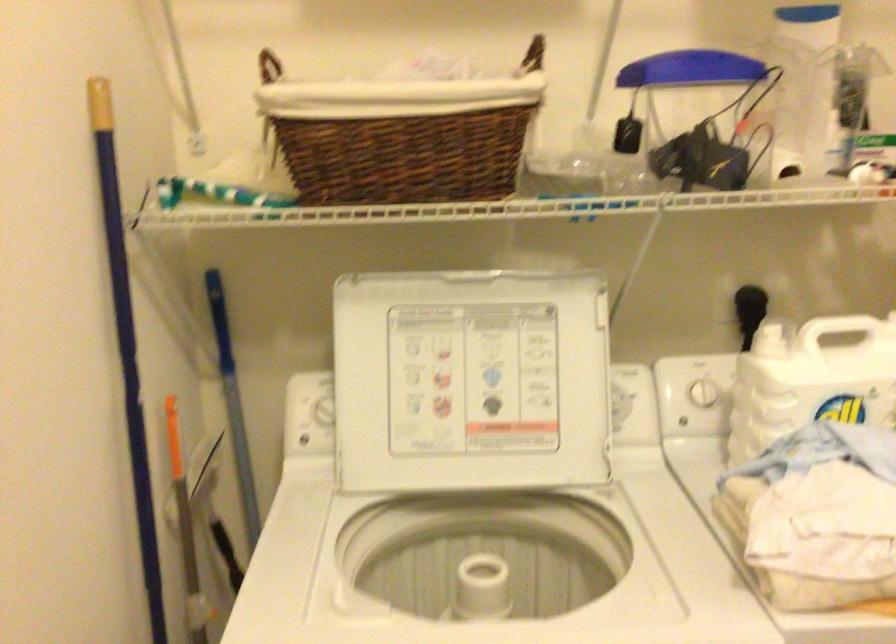
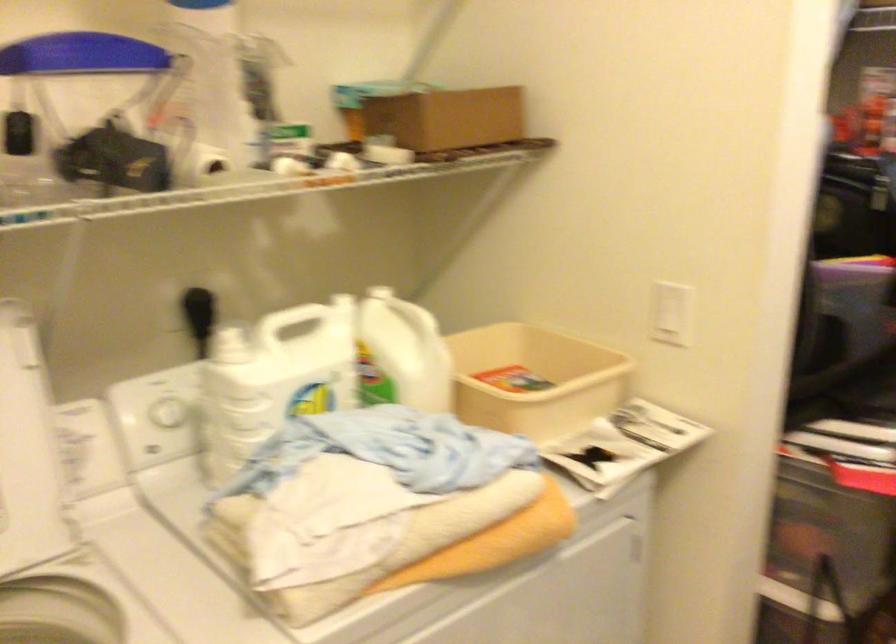
In the second image, find the point that corresponds to the point at 703,395 in the first image.

(168, 412)